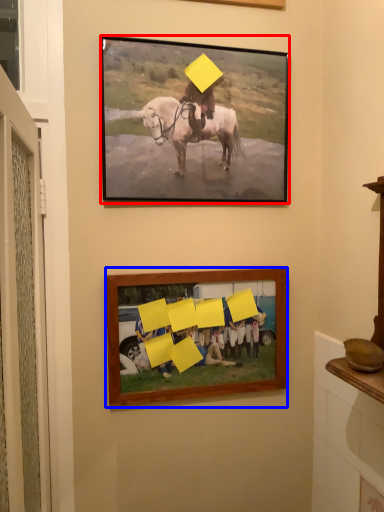
Question: Among these objects, which one is nearest to the camera, picture frame (highlighted by a red box) or picture frame (highlighted by a blue box)?

Choices:
 (A) picture frame
 (B) picture frame

Answer: (A)